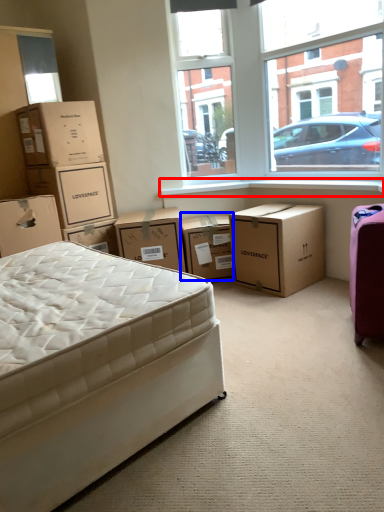
Question: Among these objects, which one is farthest to the camera, window sill (highlighted by a red box) or box (highlighted by a blue box)?

Choices:
 (A) window sill
 (B) box

Answer: (B)